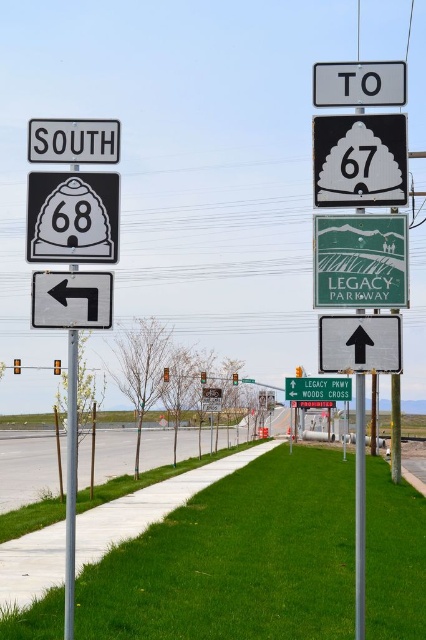
Question: Is green matte sign at center positioned behind metallic pole at left?

Choices:
 (A) yes
 (B) no

Answer: (A)

Question: Which point is farther from the camera taking this photo?

Choices:
 (A) (270, 451)
 (B) (356, 305)
 (C) (339, 72)

Answer: (A)

Question: Is green matte sign at center further to the viewer compared to green matte sign at upper center?

Choices:
 (A) no
 (B) yes

Answer: (A)

Question: Which of the following is the farthest from the observer?

Choices:
 (A) green matte sign at center
 (B) metallic pole at center
 (C) green grass at center

Answer: (C)

Question: Is green matte sign at center positioned at the back of white plastic sign at upper left?

Choices:
 (A) yes
 (B) no

Answer: (B)

Question: Which point is closer to the camera taking this photo?

Choices:
 (A) pos(296,573)
 (B) pos(97,145)
 (C) pos(362,611)

Answer: (C)